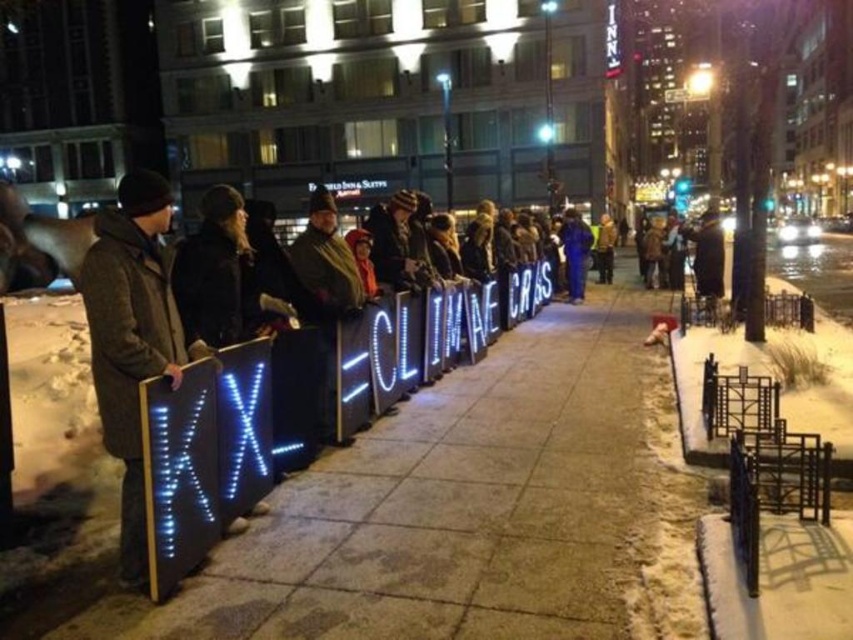
Question: Which point appears closest to the camera in this image?

Choices:
 (A) (599, 272)
 (B) (456, 476)
 (C) (561, 240)
 (D) (125, 276)

Answer: (D)

Question: Is concrete sidewalk at center positioned behind brown leather jacket at center?

Choices:
 (A) no
 (B) yes

Answer: (A)

Question: Can you confirm if dark gray wool coat at left is positioned above brown leather jacket at center?

Choices:
 (A) no
 (B) yes

Answer: (A)

Question: Considering the real-world distances, which object is farthest from the blue fabric jacket at center?

Choices:
 (A) dark gray wool coat at left
 (B) concrete sidewalk at center

Answer: (A)

Question: Is concrete sidewalk at center below dark gray wool coat at left?

Choices:
 (A) no
 (B) yes

Answer: (A)

Question: Which of the following is the closest to the observer?

Choices:
 (A) (602, 224)
 (B) (569, 292)
 (C) (144, 269)

Answer: (C)